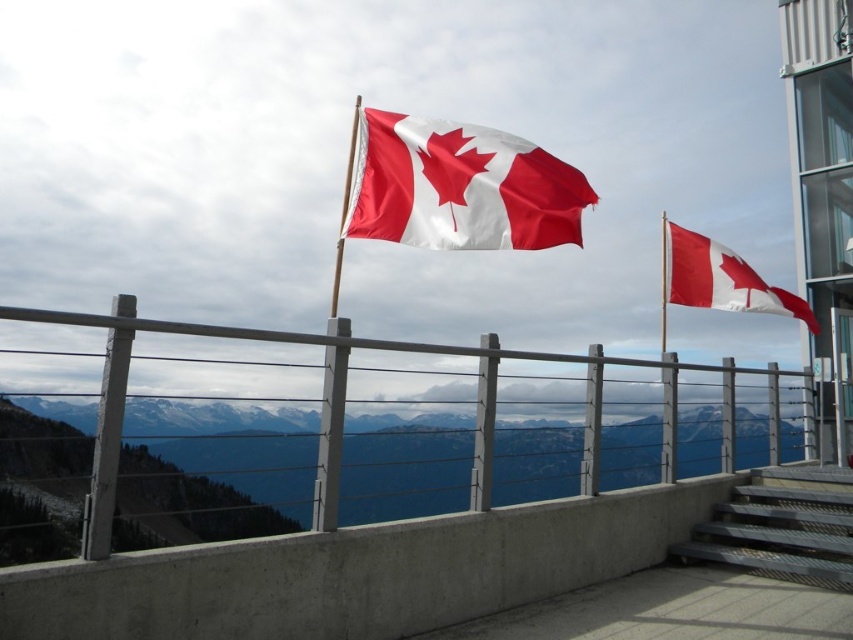
Question: Considering the real-world distances, which object is farthest from the metallic gray stairs at lower right?

Choices:
 (A) metal/rail at center
 (B) matte fabric canadian flag at center

Answer: (A)

Question: Is matte fabric canadian flag at center positioned at the back of metal/rail at center?

Choices:
 (A) no
 (B) yes

Answer: (B)

Question: Considering the real-world distances, which object is closest to the matte fabric canadian flag at center?

Choices:
 (A) metal/rail at center
 (B) metallic gray stairs at lower right

Answer: (A)

Question: In this image, where is matte fabric canadian flag at center located relative to red/white fabric flag at upper right?

Choices:
 (A) below
 (B) above

Answer: (B)

Question: Can you confirm if metallic gray stairs at lower right is smaller than red/white fabric flag at upper right?

Choices:
 (A) no
 (B) yes

Answer: (B)

Question: Among these points, which one is farthest from the camera?

Choices:
 (A) (331, 529)
 (B) (715, 262)

Answer: (B)